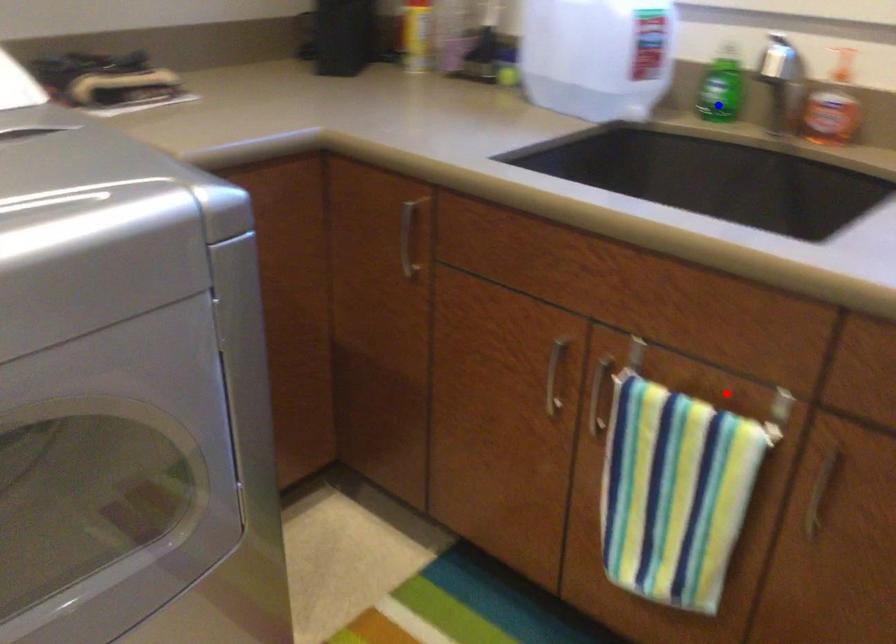
Question: Two points are marked on the image. Which point is closer to the camera?

Choices:
 (A) Blue point is closer.
 (B) Red point is closer.

Answer: (B)